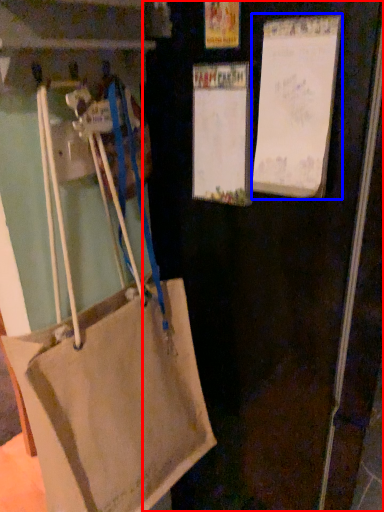
Question: Which of the following is the farthest to the observer, door (highlighted by a red box) or bulletin board (highlighted by a blue box)?

Choices:
 (A) door
 (B) bulletin board

Answer: (B)